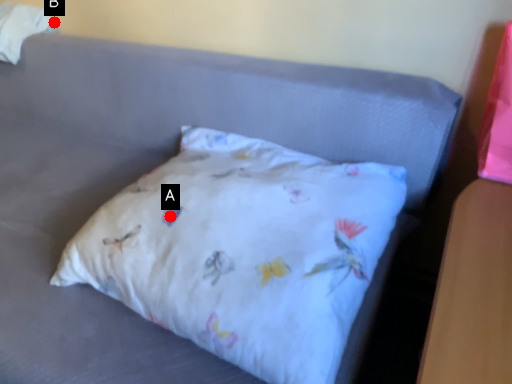
Question: Two points are circled on the image, labeled by A and B beside each circle. Which point is closer to the camera?

Choices:
 (A) A is closer
 (B) B is closer

Answer: (A)